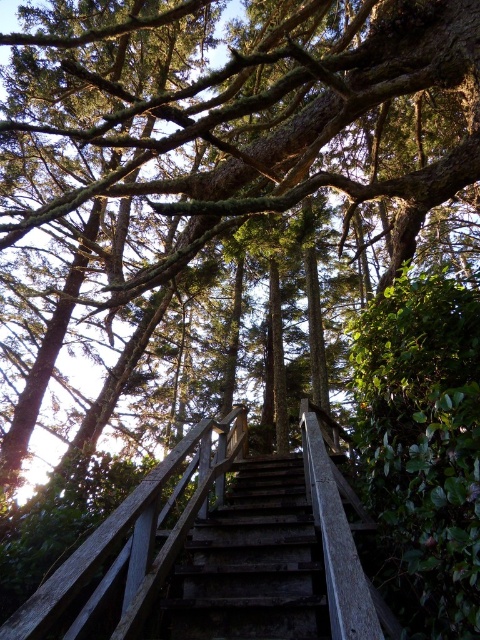
Question: Can you confirm if wooden rail at center is positioned to the right of dark brown wooden stairs at center?

Choices:
 (A) no
 (B) yes

Answer: (A)

Question: Is wooden rail at center thinner than dark brown wooden stairs at center?

Choices:
 (A) no
 (B) yes

Answer: (A)

Question: Among these objects, which one is farthest from the camera?

Choices:
 (A) wooden rail at center
 (B) dark brown wooden stairs at center

Answer: (B)

Question: Is wooden rail at center above dark brown wooden stairs at center?

Choices:
 (A) no
 (B) yes

Answer: (B)